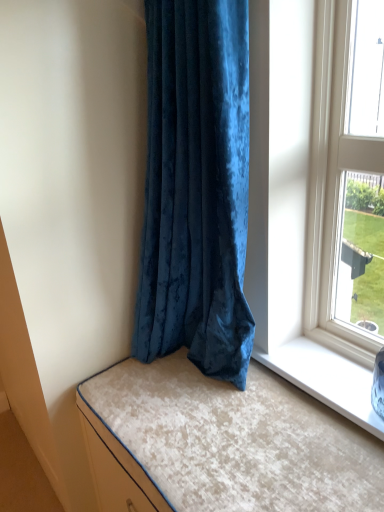
The width and height of the screenshot is (384, 512). I want to click on empty space that is ontop of velvet beige cushion at lower left (from a real-world perspective), so click(x=233, y=419).